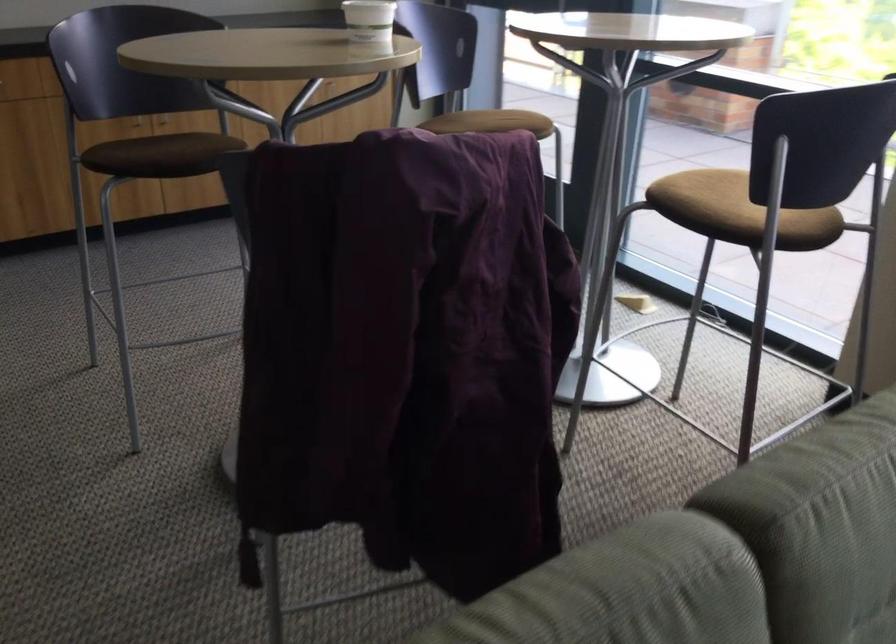
At what (x,y) coordinates should I click in order to perform the action: click on sofa armrest. Please return your answer as a coordinate pair (x, y). This screenshot has height=644, width=896. Looking at the image, I should click on (668, 585).